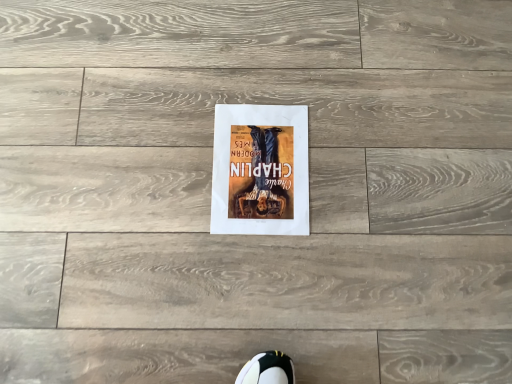
What is the approximate width of matte paper poster at center?

matte paper poster at center is 12.03 inches in width.

In order to face matte paper poster at center, should I rotate leftwards or rightwards?

A 0.880 degree turn to the right will do.

This screenshot has height=384, width=512. What do you see at coordinates (260, 170) in the screenshot?
I see `matte paper poster at center` at bounding box center [260, 170].

Where is `matte paper poster at center`? This screenshot has height=384, width=512. matte paper poster at center is located at coordinates (260, 170).

You are a GUI agent. You are given a task and a screenshot of the screen. Output one action in this format:
    pyautogui.click(x=<x>, y=<y>)
    Task: Click on the matte paper poster at center
    This screenshot has height=384, width=512.
    Given the screenshot: What is the action you would take?
    pyautogui.click(x=260, y=170)